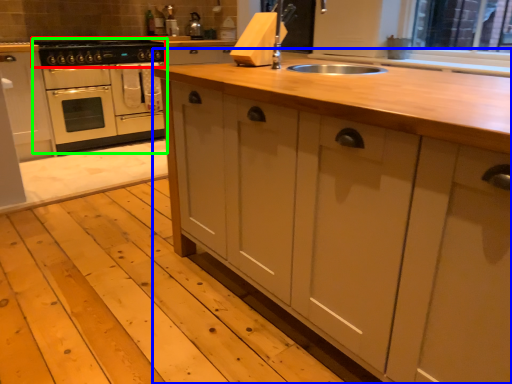
Question: Considering the real-world distances, which object is farthest from gas stove (highlighted by a red box)? countertop (highlighted by a blue box) or home appliance (highlighted by a green box)?

Choices:
 (A) countertop
 (B) home appliance

Answer: (A)